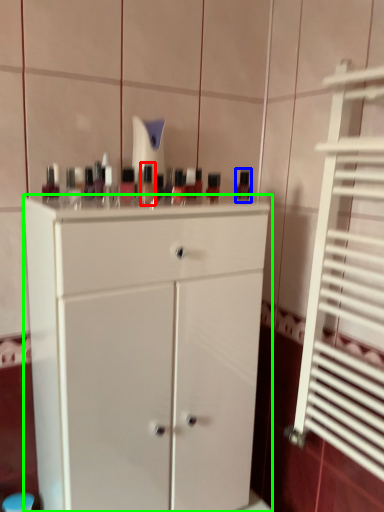
Question: Which is farther away from mouthwash (highlighted by a red box)? mouthwash (highlighted by a blue box) or chest of drawers (highlighted by a green box)?

Choices:
 (A) mouthwash
 (B) chest of drawers

Answer: (A)